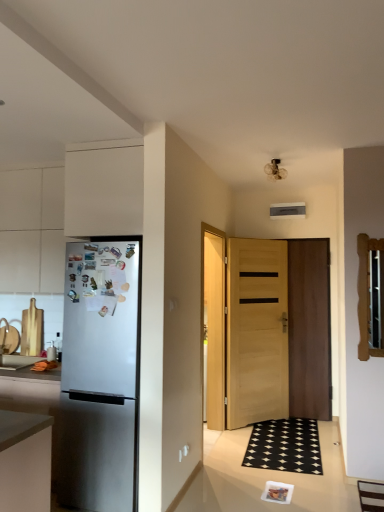
The image size is (384, 512). I want to click on blank space situated above wooden door at center, positioned as the first door in right-to-left order (from a real-world perspective), so click(x=297, y=237).